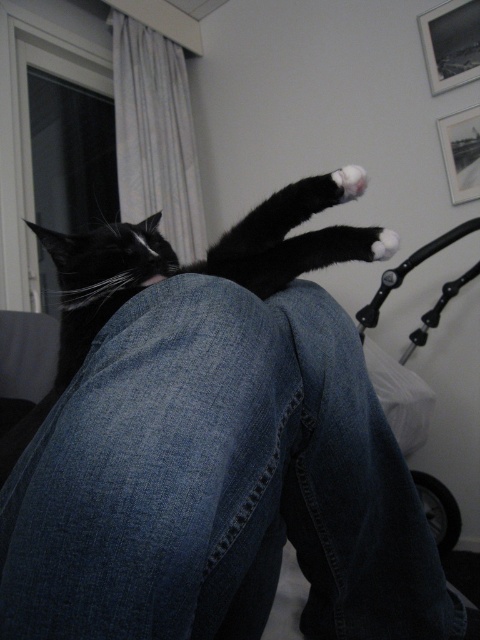
You are a photographer trying to capture the denim at center and the white fluffy paw at upper center in the same frame. Can you focus on both objects clearly at the same time?

The denim at center is in front of the white fluffy paw at upper center, so focusing on both clearly at the same time may be challenging due to their different distances from the camera.

You are a photographer trying to capture the black matte fur at center and the white fluffy paw at upper center in a single shot. Considering their height difference, which one will appear larger in the photo?

The black matte fur at center will appear larger in the photo because it is much taller than the white fluffy paw at upper center.